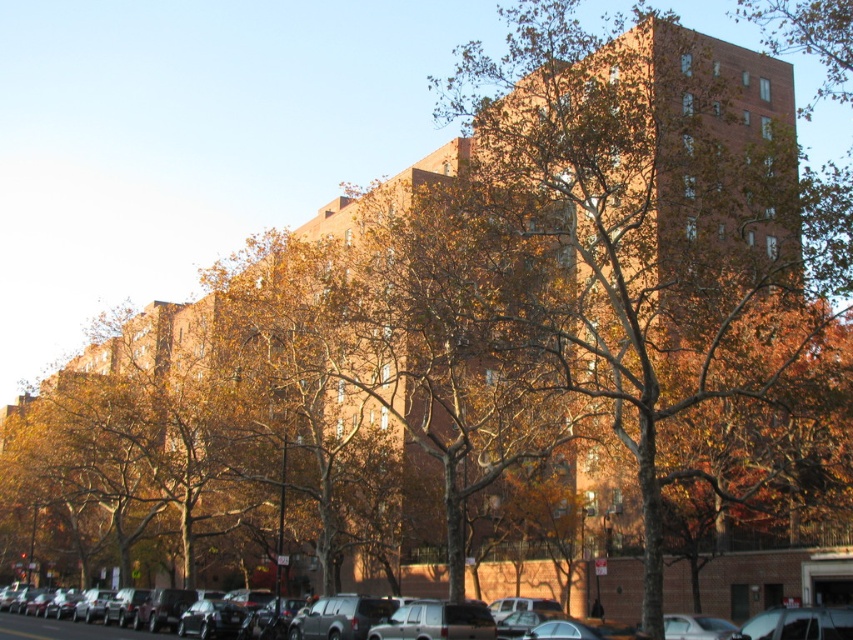
Question: Does brown textured tree at center appear over matte black suv at center?

Choices:
 (A) yes
 (B) no

Answer: (A)

Question: From the image, what is the correct spatial relationship of brown textured tree at center in relation to matte black suv at center?

Choices:
 (A) above
 (B) below

Answer: (A)

Question: In this image, where is brown textured tree at center located relative to matte black suv at center?

Choices:
 (A) right
 (B) left

Answer: (A)

Question: Which point is closer to the camera?

Choices:
 (A) (39, 618)
 (B) (680, 304)

Answer: (B)